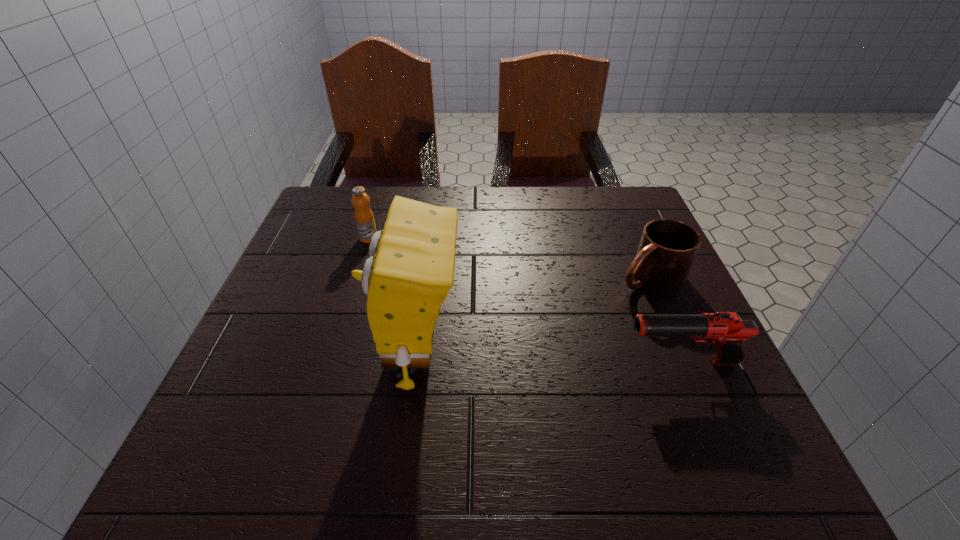
Find the location of a particular element. The height and width of the screenshot is (540, 960). free spot between the gun and the tallest object is located at coordinates (549, 360).

The height and width of the screenshot is (540, 960). What are the coordinates of `free space between the gun and the sponge` in the screenshot? It's located at (549, 360).

The image size is (960, 540). I want to click on free space between the tallest object and the gun, so click(x=549, y=360).

In order to click on free space between the farthest object and the third nearest object in this screenshot , I will do `click(509, 258)`.

Locate an element on the screen. Image resolution: width=960 pixels, height=540 pixels. vacant region between the third object from right to left and the gun is located at coordinates (549, 360).

The image size is (960, 540). In order to click on free spot between the orange juice and the third nearest object in this screenshot , I will do `click(509, 258)`.

Find the location of a particular element. Image resolution: width=960 pixels, height=540 pixels. free spot between the tallest object and the mug is located at coordinates (533, 317).

The image size is (960, 540). Find the location of `empty space that is in between the mug and the second object from left to right`. empty space that is in between the mug and the second object from left to right is located at coordinates pos(533,317).

Identify which object is the third closest to the sponge. Please provide its 2D coordinates. Your answer should be formatted as a tuple, i.e. [(x, y)], where the tuple contains the x and y coordinates of a point satisfying the conditions above.

[(667, 248)]

You are a GUI agent. You are given a task and a screenshot of the screen. Output one action in this format:
    pyautogui.click(x=<x>, y=<y>)
    Task: Click on the third closest object to the sponge
    
    Given the screenshot: What is the action you would take?
    pyautogui.click(x=667, y=248)